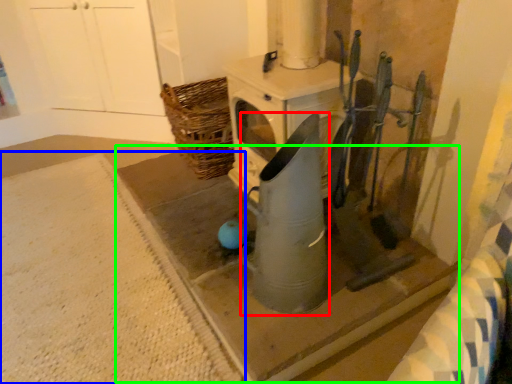
Question: Estimate the real-world distances between objects in this image. Which object is farther from appliance (highlighted by a red box), concrete (highlighted by a blue box) or concrete (highlighted by a green box)?

Choices:
 (A) concrete
 (B) concrete

Answer: (A)